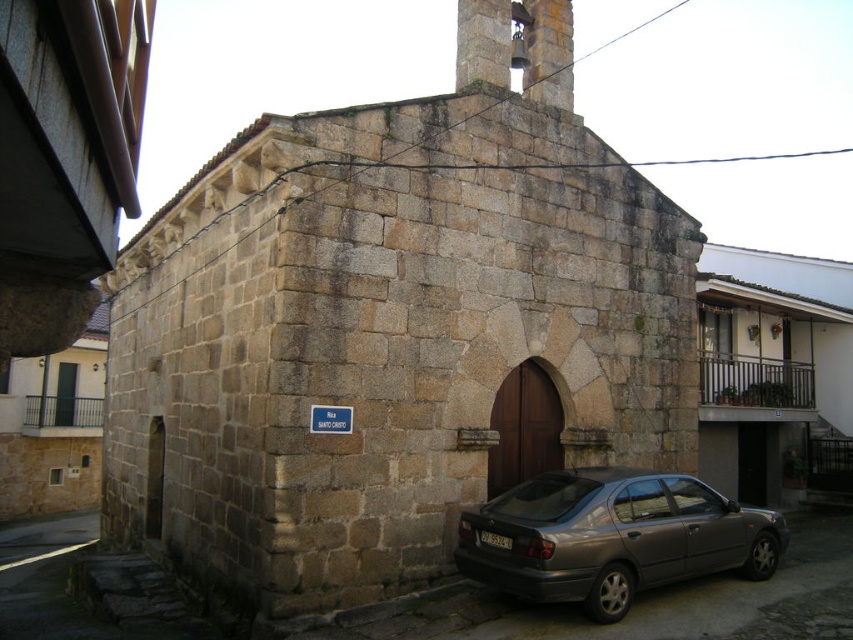
Question: Which point is closer to the camera?

Choices:
 (A) metallic gray sedan at lower right
 (B) stone chapel at center

Answer: (A)

Question: Can you confirm if stone chapel at center is smaller than metallic gray sedan at lower right?

Choices:
 (A) yes
 (B) no

Answer: (B)

Question: Is stone chapel at center to the right of metallic gray sedan at lower right from the viewer's perspective?

Choices:
 (A) yes
 (B) no

Answer: (B)

Question: Which point is farther from the camera taking this photo?

Choices:
 (A) (491, 444)
 (B) (701, 536)

Answer: (A)

Question: In this image, where is stone chapel at center located relative to metallic gray sedan at lower right?

Choices:
 (A) above
 (B) below

Answer: (A)